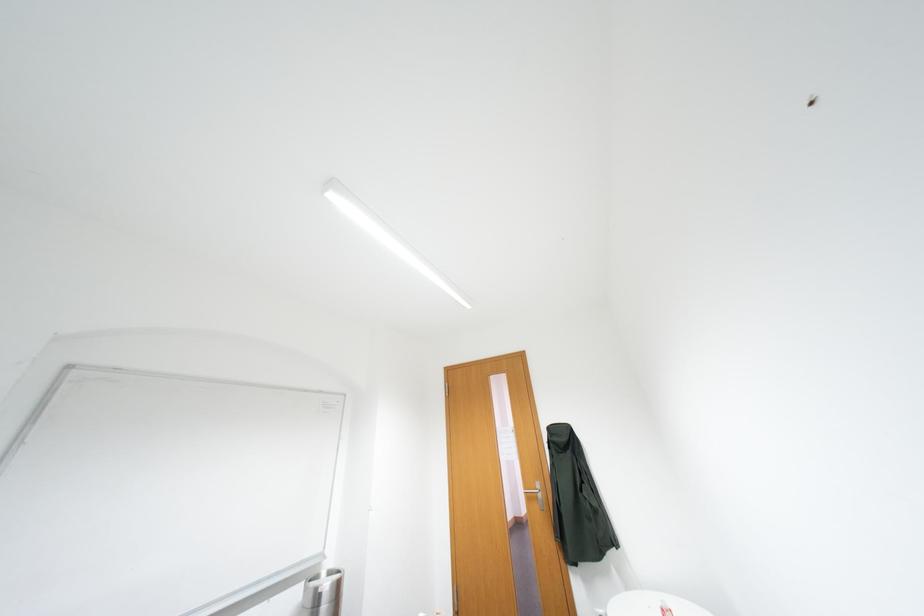
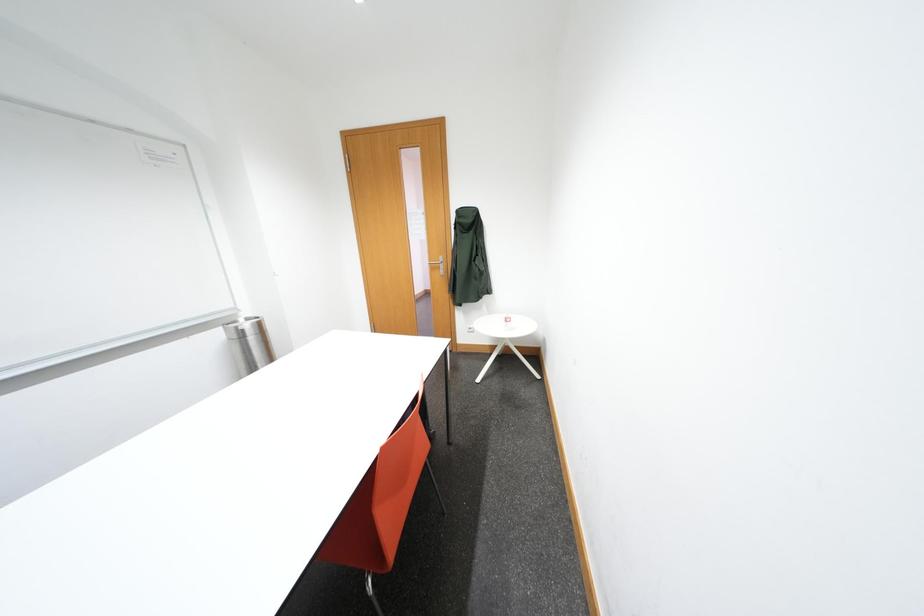
From the picture: How did the camera likely rotate?

The rotation direction of the camera is right-down.